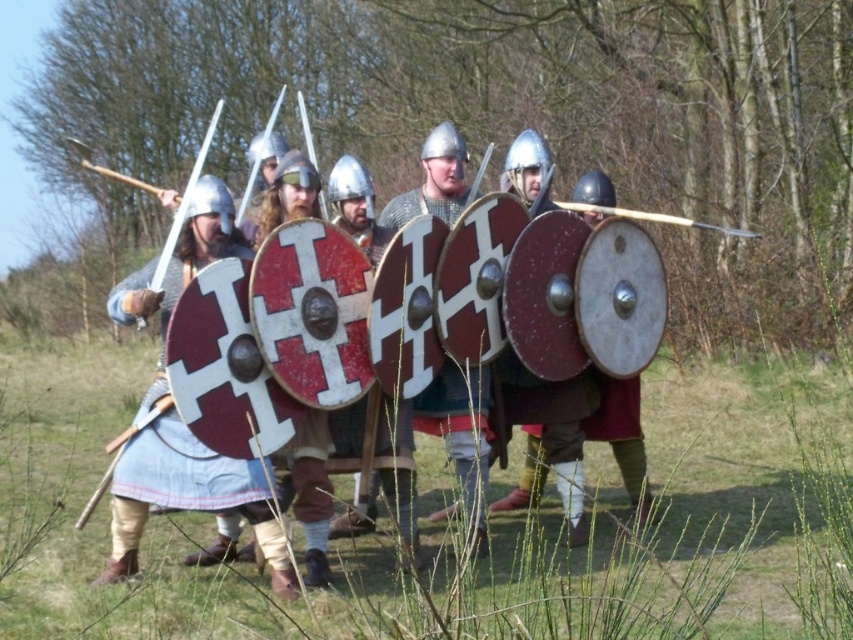
Can you confirm if matte silver helmet at center is taller than wooden spear at center?

Indeed, matte silver helmet at center has a greater height compared to wooden spear at center.

Is matte silver helmet at center wider than wooden spear at center?

Indeed, matte silver helmet at center has a greater width compared to wooden spear at center.

The height and width of the screenshot is (640, 853). Find the location of `matte silver helmet at center`. matte silver helmet at center is located at coordinates (555, 426).

Is wooden staff at lower left positioned in front of wooden spear at center?

Yes, it is in front of wooden spear at center.

Does wooden staff at lower left have a greater height compared to wooden spear at center?

Indeed, wooden staff at lower left has a greater height compared to wooden spear at center.

This screenshot has height=640, width=853. Identify the location of wooden staff at lower left. (120, 454).

From the picture: Is shiny silver sword at left to the right of wooden spear at center from the viewer's perspective?

Incorrect, shiny silver sword at left is not on the right side of wooden spear at center.

Consider the image. Who is more distant from viewer, (138, 323) or (567, 204)?

Positioned behind is point (567, 204).

Locate an element on the screen. The image size is (853, 640). shiny silver sword at left is located at coordinates (184, 200).